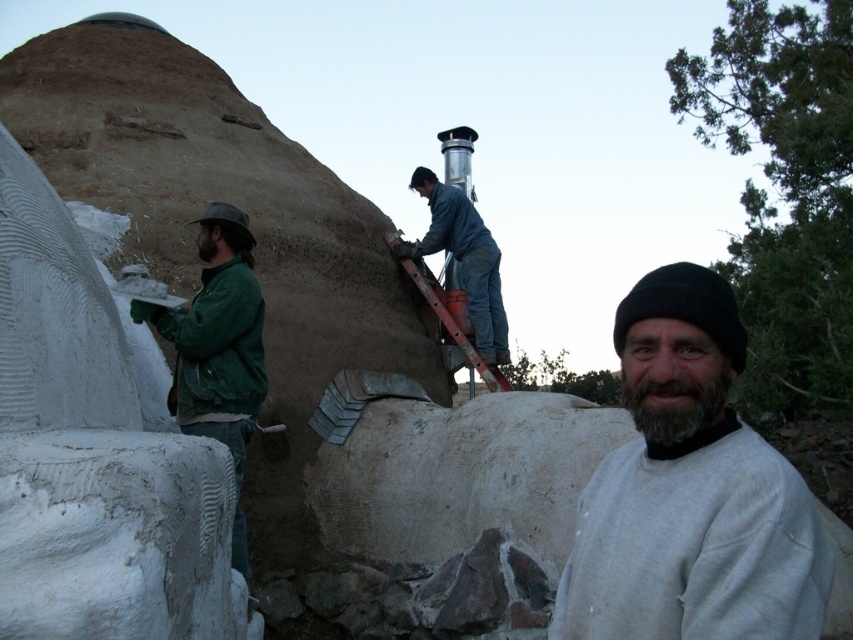
Does gray cotton sweatshirt at center have a smaller size compared to blue denim overalls at center?

No, gray cotton sweatshirt at center is not smaller than blue denim overalls at center.

Between gray cotton sweatshirt at center and blue denim overalls at center, which one has less height?

Standing shorter between the two is blue denim overalls at center.

Does point (621, 608) come closer to viewer compared to point (430, 225)?

Yes, point (621, 608) is in front of point (430, 225).

Image resolution: width=853 pixels, height=640 pixels. I want to click on gray cotton sweatshirt at center, so click(689, 492).

Does point (628, 556) come behind point (215, 225)?

No, (628, 556) is closer to viewer.

Can you confirm if gray cotton sweatshirt at center is thinner than green matte jacket at left?

No.

Which is behind, point (780, 460) or point (238, 531)?

Point (238, 531)

This screenshot has height=640, width=853. Identify the location of gray cotton sweatshirt at center. (689, 492).

Is the position of green matte jacket at left more distant than that of blue denim overalls at center?

That is False.

Is green matte jacket at left wider than blue denim overalls at center?

Incorrect, green matte jacket at left's width does not surpass blue denim overalls at center's.

Is point (252, 336) closer to viewer compared to point (447, 218)?

Yes.

In order to click on green matte jacket at left in this screenshot , I will do `click(218, 348)`.